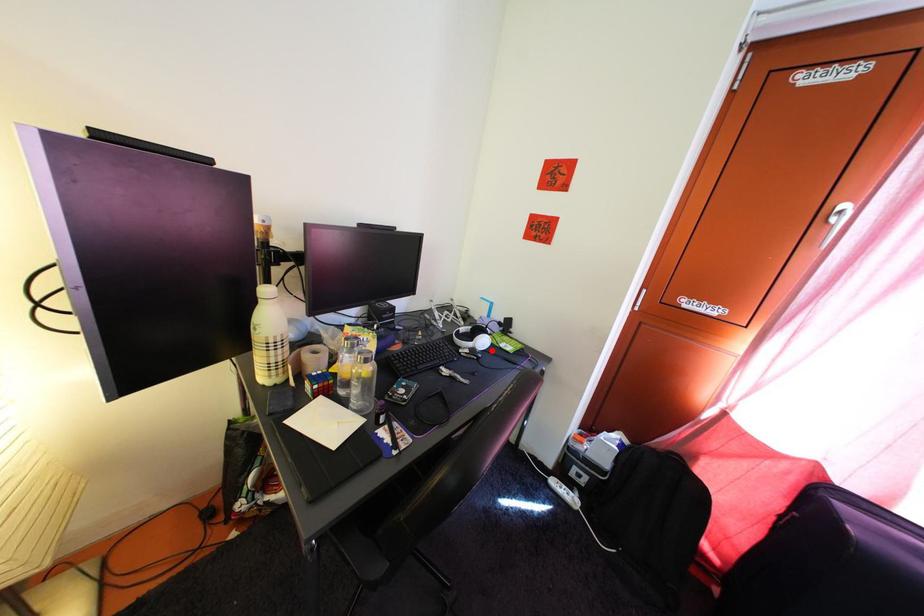
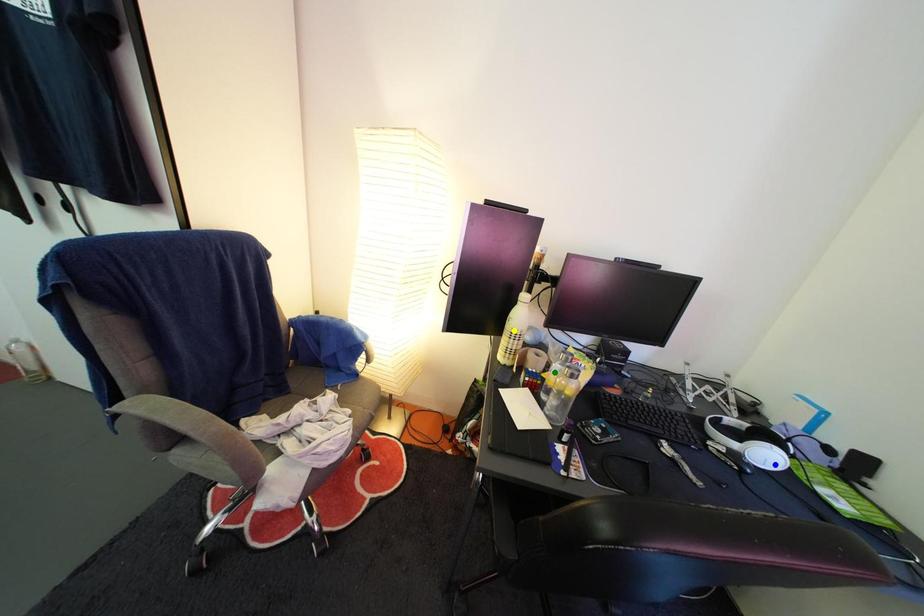
Question: I am providing you with two images of the same scene from different viewpoints. A red point is marked on the first image. You are given multiple points on the second image. Which spot in image 2 lines up with the point in image 1?

Choices:
 (A) green point
 (B) yellow point
 (C) blue point

Answer: (C)